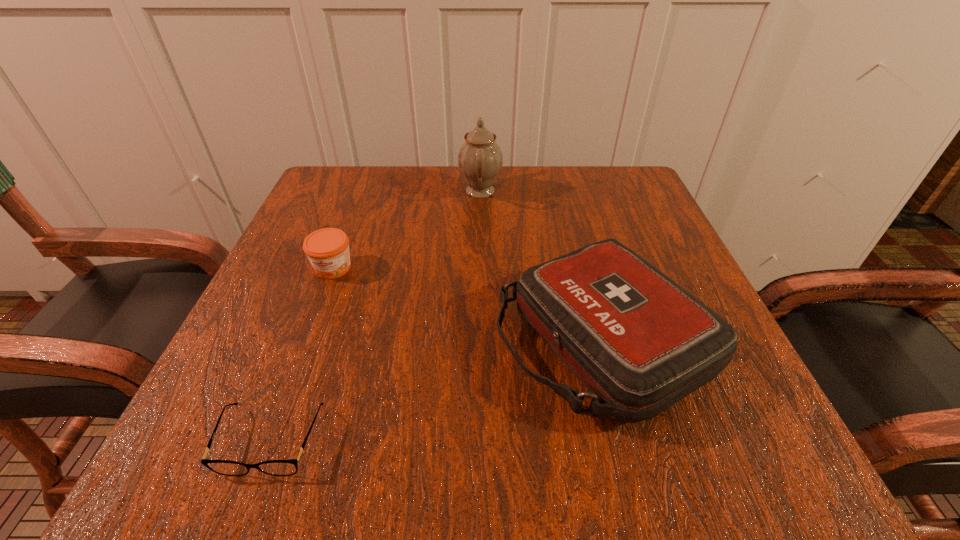
The width and height of the screenshot is (960, 540). Find the location of `the tallest object`. the tallest object is located at coordinates (480, 159).

Locate an element on the screen. The width and height of the screenshot is (960, 540). the farthest object is located at coordinates (480, 159).

I want to click on the first-aid kit, so click(638, 342).

In order to click on jam in this screenshot , I will do `click(327, 249)`.

Locate an element on the screen. the shortest object is located at coordinates (223, 467).

Find the location of a particular element. This screenshot has height=540, width=960. vacant space located on the spout of the tallest object is located at coordinates (321, 191).

Identify the location of free space located 0.130m on the spout of the tallest object. (402, 191).

At what (x,y) coordinates should I click in order to perform the action: click on vacant space located on the spout of the tallest object. Please return your answer as a coordinate pair (x, y). The image size is (960, 540). Looking at the image, I should click on (334, 191).

Image resolution: width=960 pixels, height=540 pixels. I want to click on free location located 0.340m on the back of the first-aid kit, so click(x=559, y=180).

This screenshot has height=540, width=960. I want to click on free space located on the front label of the jam, so click(278, 411).